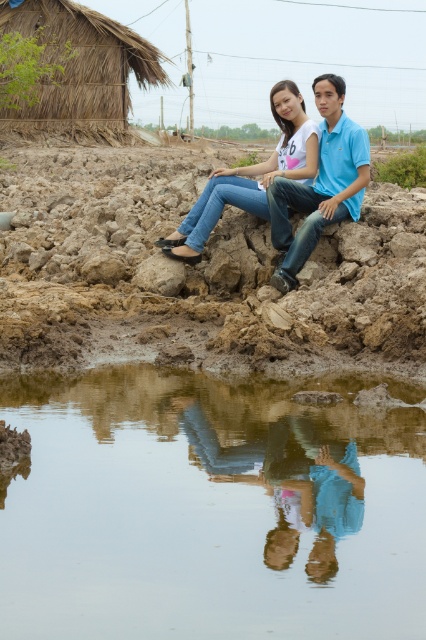
Between point (57, 586) and point (259, 168), which one is positioned behind?

Positioned behind is point (259, 168).

Which of these two, transparent glass puddle at lower center or jeans at center, stands taller?

Standing taller between the two is jeans at center.

Between point (198, 624) and point (261, 192), which one is positioned behind?

The point (261, 192) is behind.

Locate an element on the screen. The width and height of the screenshot is (426, 640). transparent glass puddle at lower center is located at coordinates (210, 509).

Can you confirm if thatched straw hut at upper left is positioned to the left of blue cotton shirt at center?

Indeed, thatched straw hut at upper left is positioned on the left side of blue cotton shirt at center.

Can you confirm if thatched straw hut at upper left is positioned above blue cotton shirt at center?

Yes, thatched straw hut at upper left is above blue cotton shirt at center.

This screenshot has height=640, width=426. Describe the element at coordinates (81, 67) in the screenshot. I see `thatched straw hut at upper left` at that location.

Where is `thatched straw hut at upper left`? This screenshot has height=640, width=426. thatched straw hut at upper left is located at coordinates (81, 67).

Which is behind, point (278, 579) or point (296, 240)?

Positioned behind is point (296, 240).

In the scene shown: Who is positioned more to the left, transparent glass puddle at lower center or blue cotton shirt at center?

transparent glass puddle at lower center

You are a GUI agent. You are given a task and a screenshot of the screen. Output one action in this format:
    pyautogui.click(x=<x>, y=<y>)
    Task: Click on the transparent glass puddle at lower center
    This screenshot has width=426, height=640.
    Given the screenshot: What is the action you would take?
    pyautogui.click(x=210, y=509)